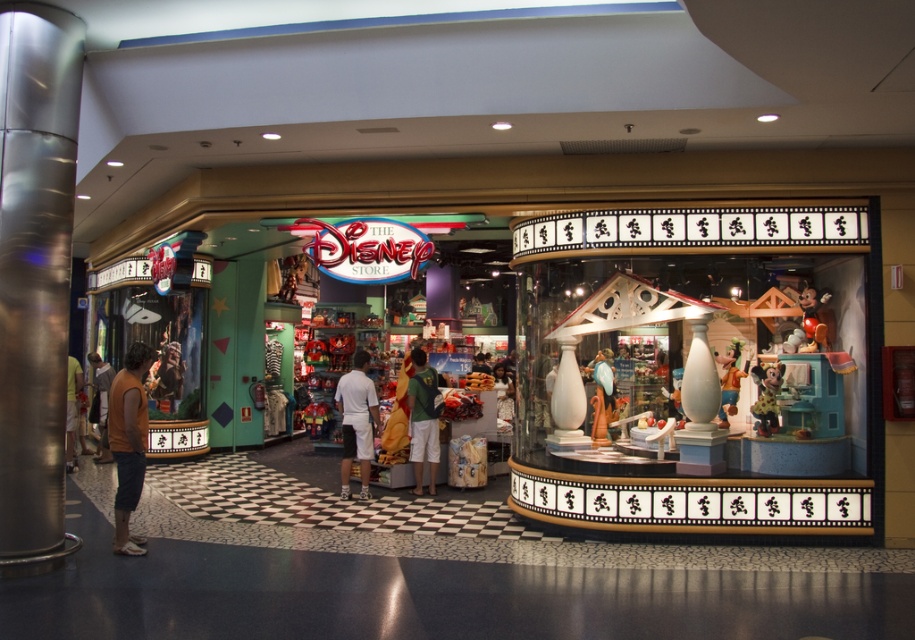
Question: Which point is closer to the camera?

Choices:
 (A) orange sleeveless shirt at left
 (B) matte black display case at left
 (C) matte brown shirt at left
 (D) brown leather jacket at left

Answer: (A)

Question: Considering the real-world distances, which object is closest to the shiny gold mickey mouse statue at center?

Choices:
 (A) matte black display case at left
 (B) orange sleeveless shirt at left
 (C) white cotton shorts at center

Answer: (C)

Question: Does matte black display case at left have a smaller size compared to orange sleeveless shirt at left?

Choices:
 (A) no
 (B) yes

Answer: (B)

Question: Considering the relative positions of green jersey at center and shiny gold mickey mouse statue at center in the image provided, where is green jersey at center located with respect to shiny gold mickey mouse statue at center?

Choices:
 (A) right
 (B) left

Answer: (B)

Question: Which object appears closest to the camera in this image?

Choices:
 (A) orange sleeveless shirt at left
 (B) shiny gold mickey mouse statue at center

Answer: (A)

Question: Does brown leather jacket at left appear over matte brown shirt at left?

Choices:
 (A) no
 (B) yes

Answer: (B)